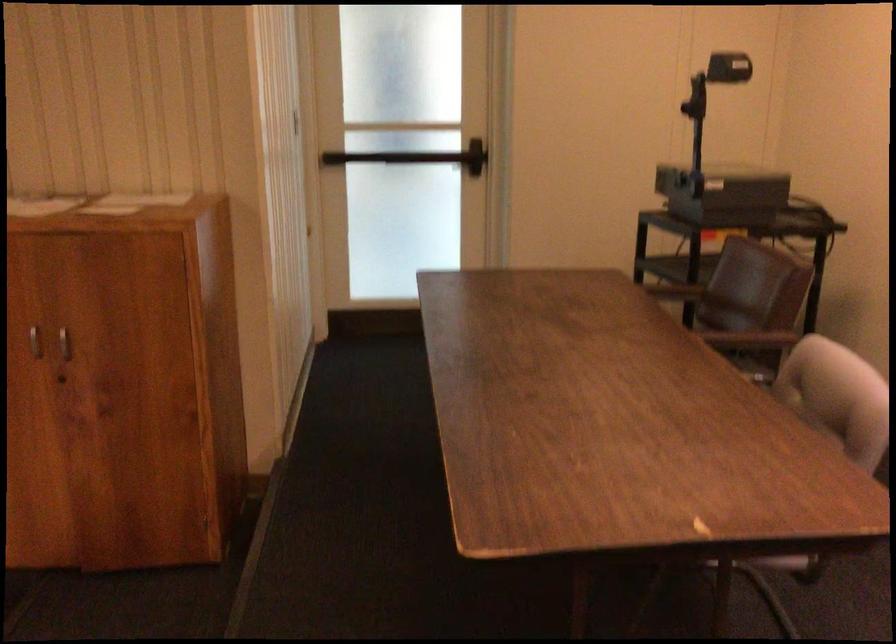
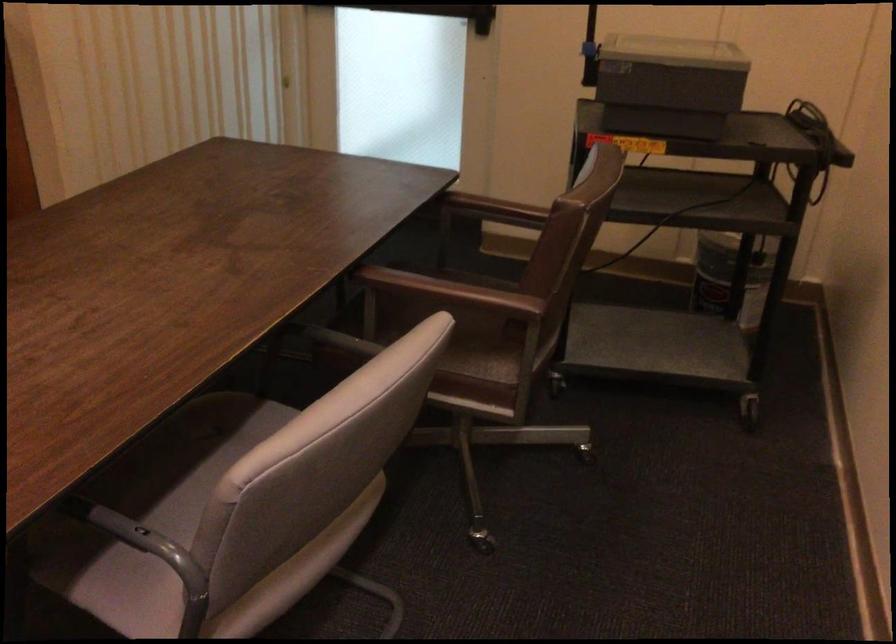
The point at (737, 192) is marked in the first image. Where is the corresponding point in the second image?

(668, 84)